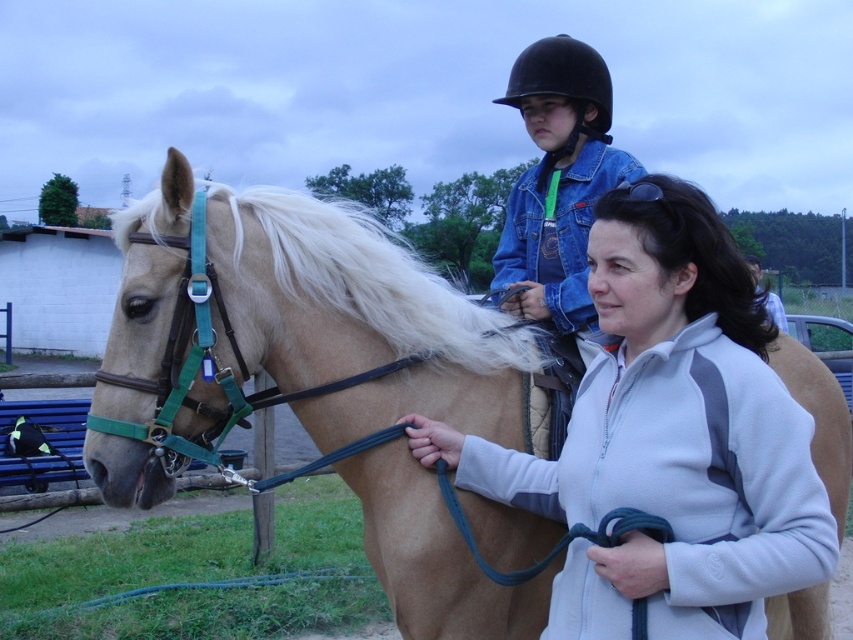
Question: Can you confirm if tan leather horse at center is positioned above black matte helmet at upper center?

Choices:
 (A) no
 (B) yes

Answer: (A)

Question: Which of the following is the farthest from the observer?

Choices:
 (A) (563, 83)
 (B) (260, 358)

Answer: (A)

Question: Which point appears closest to the camera in this image?

Choices:
 (A) (257, 188)
 (B) (567, 51)

Answer: (A)

Question: Which of the following is the closest to the observer?

Choices:
 (A) black matte helmet at upper center
 (B) tan leather horse at center

Answer: (B)

Question: Can you confirm if tan leather horse at center is positioned above black matte helmet at upper center?

Choices:
 (A) yes
 (B) no

Answer: (B)

Question: Is tan leather horse at center closer to camera compared to black matte helmet at upper center?

Choices:
 (A) no
 (B) yes

Answer: (B)